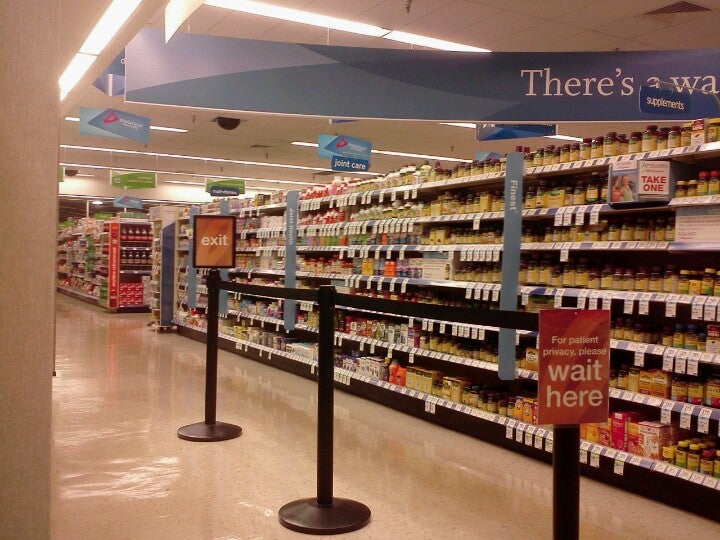
The height and width of the screenshot is (540, 720). Find the location of `lights`. lights is located at coordinates (346, 31), (111, 26).